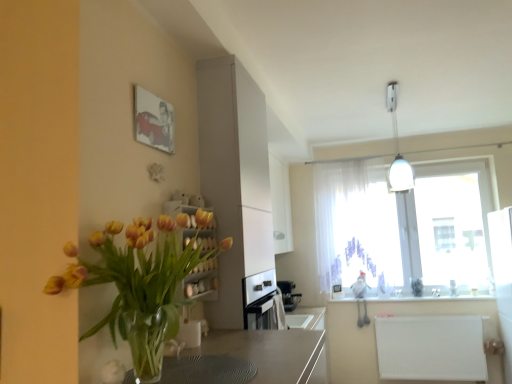
The image size is (512, 384). I want to click on vacant space situated above white matte radiator at lower right, the 1th counter top in the bottom-to-top sequence (from a real-world perspective), so click(x=429, y=314).